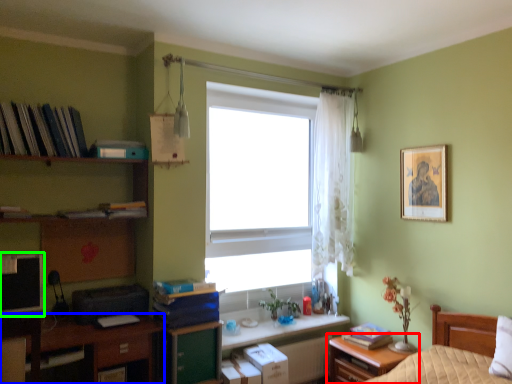
Question: Which object is the closest to the nightstand (highlighted by a red box)? Choose among these: desk (highlighted by a blue box) or computer monitor (highlighted by a green box).

Choices:
 (A) desk
 (B) computer monitor

Answer: (A)